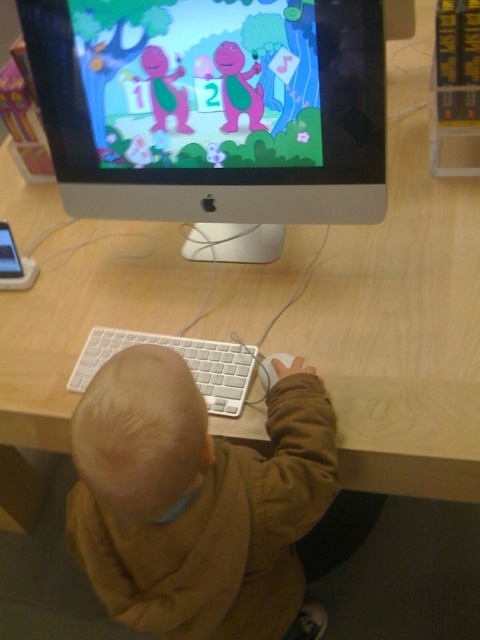
You are a parent trying to ensure your child is sitting properly at the desk. Which object is closer to the child, the brown cotton hoodie at lower center or the white plastic keyboard at center?

The brown cotton hoodie at lower center is closer to the viewer than the white plastic keyboard at center, so the hoodie is closer to the child.

You are a photographer setting up a shot of the computer setup. You need to focus on both point (137, 336) and point (267, 380). Which point should you focus on first to ensure both are in focus?

You should focus on point (137, 336) first because it is closer to the camera than point (267, 380), so adjusting focus from closer to farther will help both points be in focus.